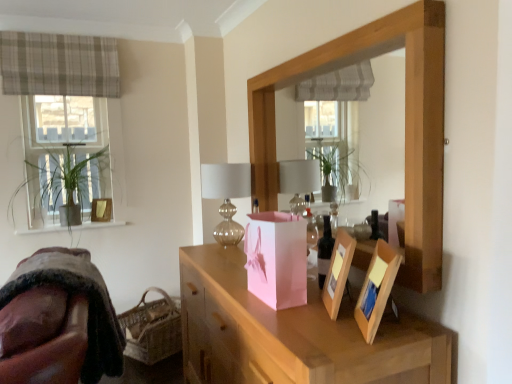
Question: Considering the relative sizes of dark brown glass bottle at center and woven brown basket at lower left in the image provided, is dark brown glass bottle at center bigger than woven brown basket at lower left?

Choices:
 (A) yes
 (B) no

Answer: (B)

Question: From a real-world perspective, is dark brown glass bottle at center positioned under woven brown basket at lower left based on gravity?

Choices:
 (A) no
 (B) yes

Answer: (A)

Question: Does dark brown glass bottle at center contain woven brown basket at lower left?

Choices:
 (A) yes
 (B) no

Answer: (B)

Question: Is dark brown glass bottle at center oriented away from woven brown basket at lower left?

Choices:
 (A) yes
 (B) no

Answer: (B)

Question: Is dark brown glass bottle at center wider than woven brown basket at lower left?

Choices:
 (A) no
 (B) yes

Answer: (A)

Question: Considering the relative sizes of dark brown glass bottle at center and woven brown basket at lower left in the image provided, is dark brown glass bottle at center taller than woven brown basket at lower left?

Choices:
 (A) no
 (B) yes

Answer: (A)

Question: From the image's perspective, is plaid fabric curtain at upper left below matte gold picture frame at upper left?

Choices:
 (A) yes
 (B) no

Answer: (B)

Question: Considering the relative sizes of plaid fabric curtain at upper left and matte gold picture frame at upper left in the image provided, is plaid fabric curtain at upper left smaller than matte gold picture frame at upper left?

Choices:
 (A) yes
 (B) no

Answer: (B)

Question: Is plaid fabric curtain at upper left bigger than matte gold picture frame at upper left?

Choices:
 (A) yes
 (B) no

Answer: (A)

Question: Is plaid fabric curtain at upper left turned away from matte gold picture frame at upper left?

Choices:
 (A) yes
 (B) no

Answer: (B)

Question: Is plaid fabric curtain at upper left to the left of matte gold picture frame at upper left from the viewer's perspective?

Choices:
 (A) yes
 (B) no

Answer: (A)

Question: From a real-world perspective, is plaid fabric curtain at upper left over matte gold picture frame at upper left?

Choices:
 (A) no
 (B) yes

Answer: (B)

Question: Would you say translucent glass table lamp at center is a long distance from pink paper bag at center?

Choices:
 (A) yes
 (B) no

Answer: (B)